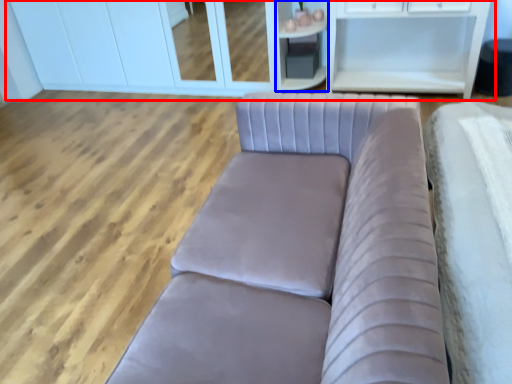
Question: Which object appears closest to the camera in this image, dresser (highlighted by a red box) or cabinetry (highlighted by a blue box)?

Choices:
 (A) dresser
 (B) cabinetry

Answer: (B)